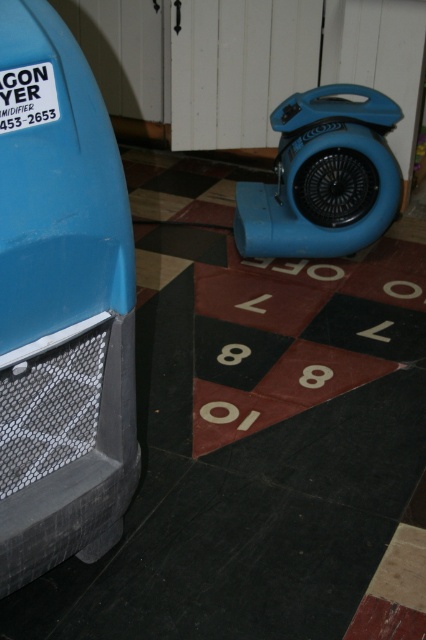
Question: Can you confirm if matte blue car at left is positioned above blue plastic fan at center right?

Choices:
 (A) yes
 (B) no

Answer: (B)

Question: Can you confirm if matte blue car at left is bigger than blue plastic fan at center right?

Choices:
 (A) no
 (B) yes

Answer: (A)

Question: Which point is closer to the camera taking this photo?

Choices:
 (A) (241, 218)
 (B) (104, 502)

Answer: (B)

Question: Does matte blue car at left lie behind blue plastic fan at center right?

Choices:
 (A) no
 (B) yes

Answer: (A)